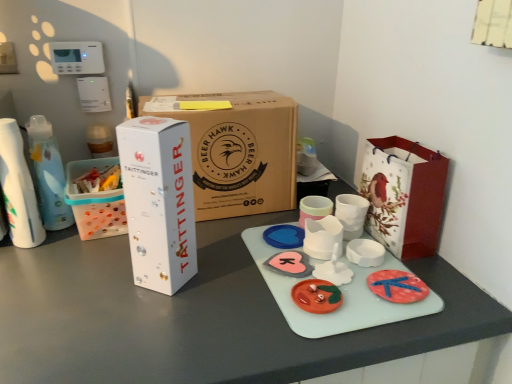
This screenshot has height=384, width=512. In order to click on vacant space in front of blue rubber heart at center, the first toy from the back in this screenshot , I will do `click(272, 276)`.